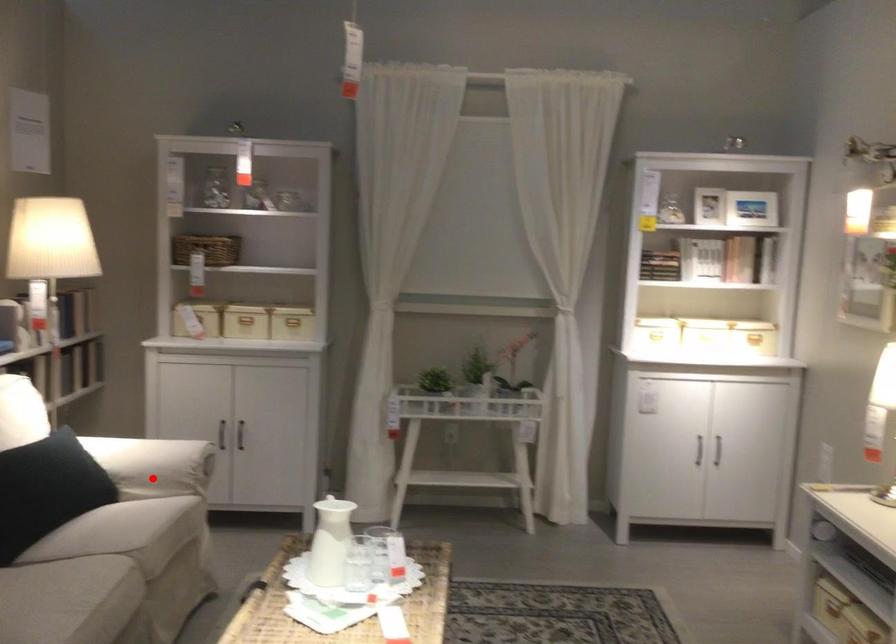
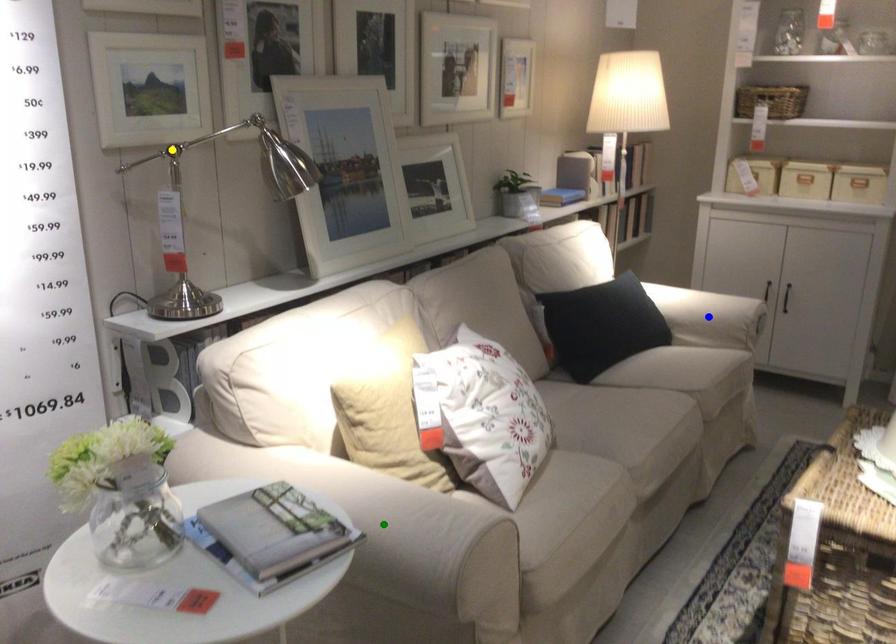
Question: I am providing you with two images of the same scene from different viewpoints. A red point is marked on the first image. You are given multiple points on the second image. In image 2, which mark is for the same physical point as the one in image 1?

Choices:
 (A) yellow point
 (B) green point
 (C) blue point

Answer: (C)